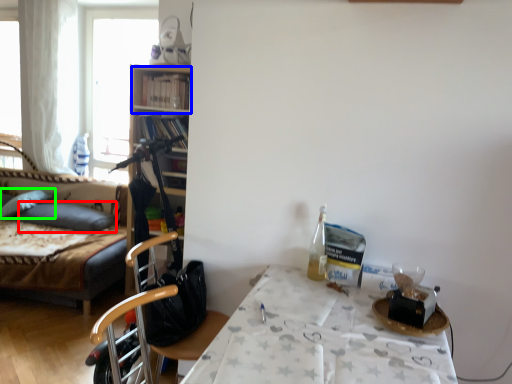
Question: Which is nearer to the pillow (highlighted by a red box)? shelf (highlighted by a blue box) or pillow (highlighted by a green box).

Choices:
 (A) shelf
 (B) pillow

Answer: (B)